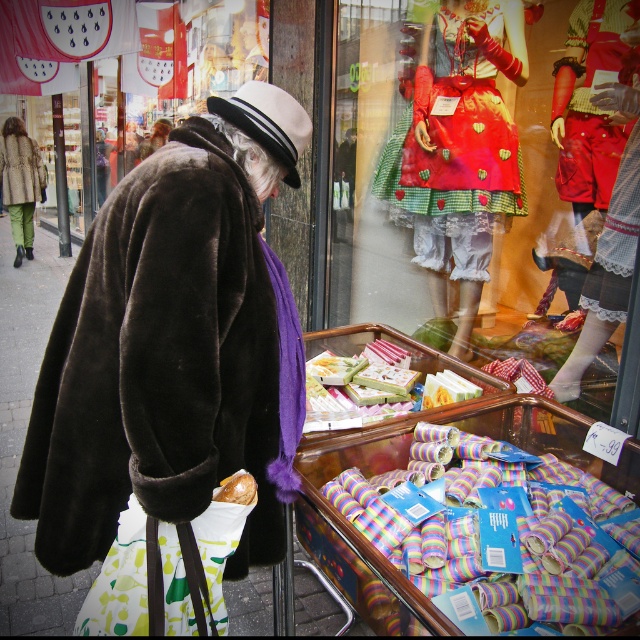
You are an interior designer observing the shop window display. You notice the matte red fabric dress at center and the white felt hat at center. Which object is positioned to the right of the other?

The matte red fabric dress at center is to the right of the white felt hat at center.

You are a delivery person who needs to place a package between the brown fur coat at left and the gold foil candy at lower center. The package is 2 meters long. Will it fit in the space between them?

The distance between the brown fur coat at left and the gold foil candy at lower center is 8.34 meters. Since the package is only 2 meters long, it will easily fit within the available space.